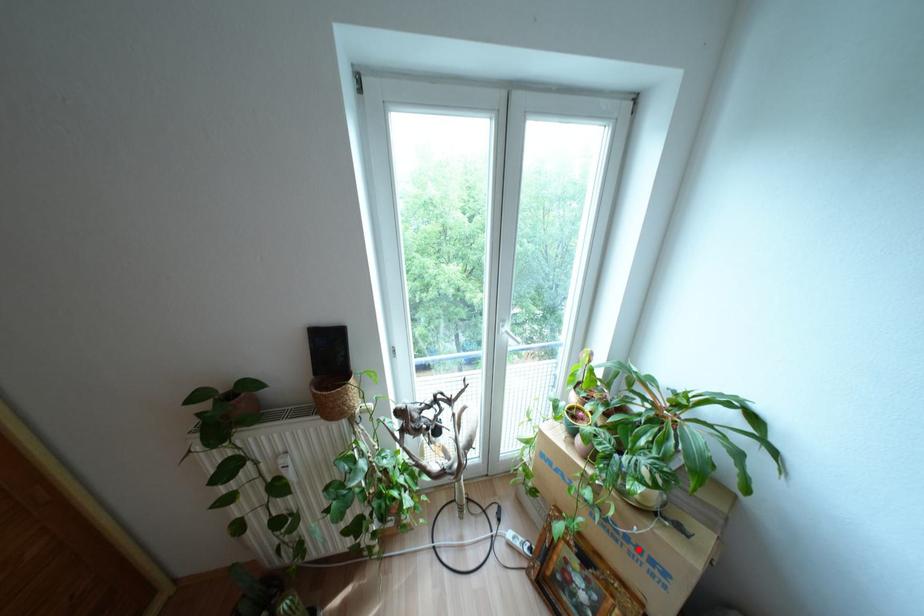
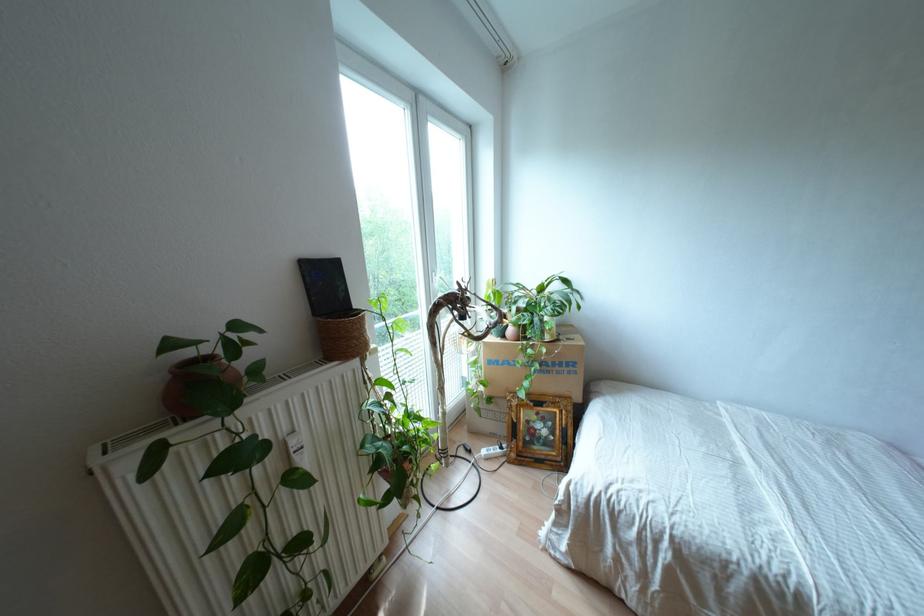
Locate, in the second image, the point that corresponds to the highlighted location in the first image.

(560, 363)